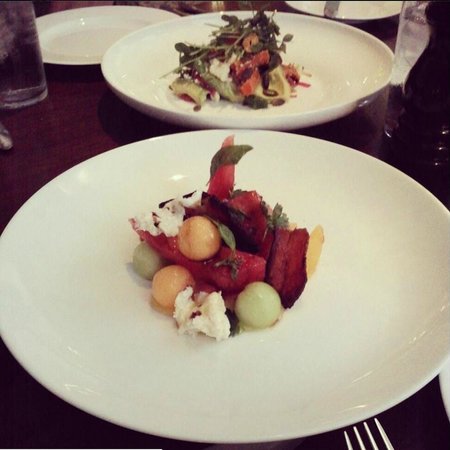
You are a GUI agent. You are given a task and a screenshot of the screen. Output one action in this format:
    pyautogui.click(x=<x>, y=<y>)
    Task: Click on the pepper shaker
    
    Given the screenshot: What is the action you would take?
    pyautogui.click(x=433, y=97)